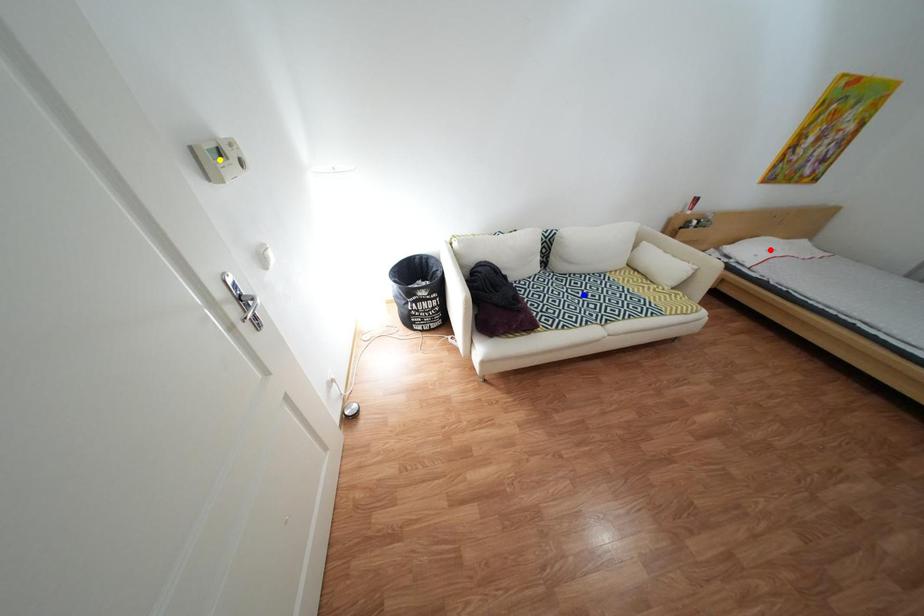
Order these from farthest to nearest:
yellow point | red point | blue point

red point < blue point < yellow point